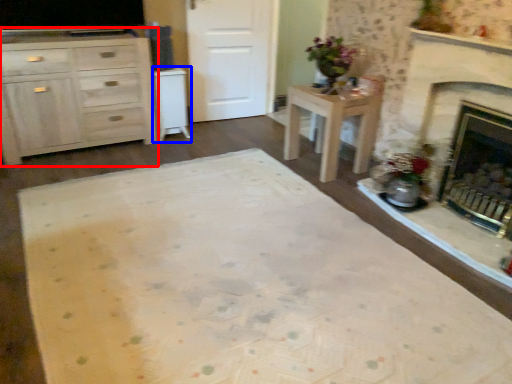
Question: Which of the following is the farthest to the observer, cabinetry (highlighted by a red box) or cabinetry (highlighted by a blue box)?

Choices:
 (A) cabinetry
 (B) cabinetry

Answer: (B)